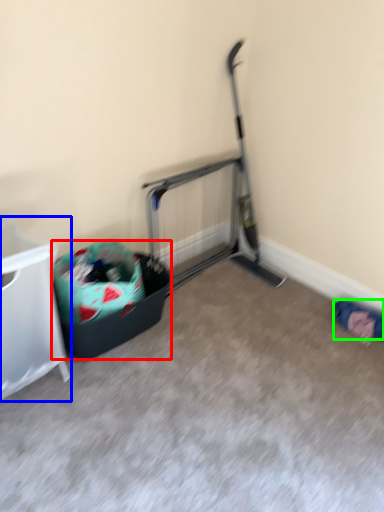
Question: Which is farther away from recycling bin (highlighted by a red box)? furniture (highlighted by a blue box) or clothing (highlighted by a green box)?

Choices:
 (A) furniture
 (B) clothing

Answer: (B)